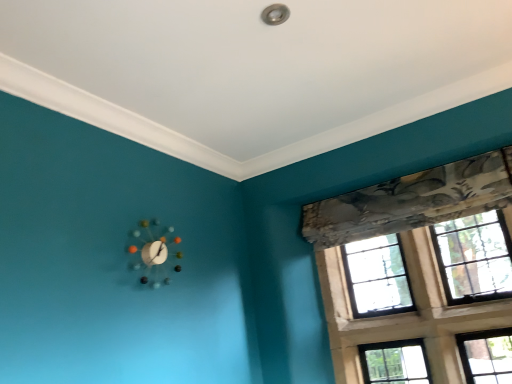
The width and height of the screenshot is (512, 384). In order to click on metallic silver clock at center in this screenshot , I will do `click(153, 252)`.

What do you see at coordinates (153, 252) in the screenshot? The image size is (512, 384). I see `metallic silver clock at center` at bounding box center [153, 252].

Measure the distance between point (x=178, y=238) and camera.

Point (x=178, y=238) and camera are 7.16 feet apart from each other.

The height and width of the screenshot is (384, 512). I want to click on metallic silver clock at center, so click(x=153, y=252).